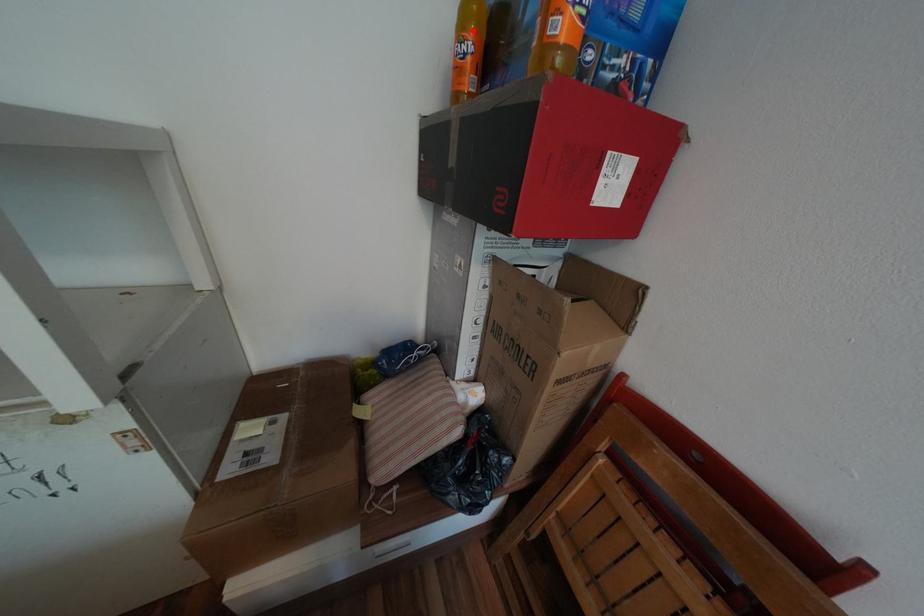
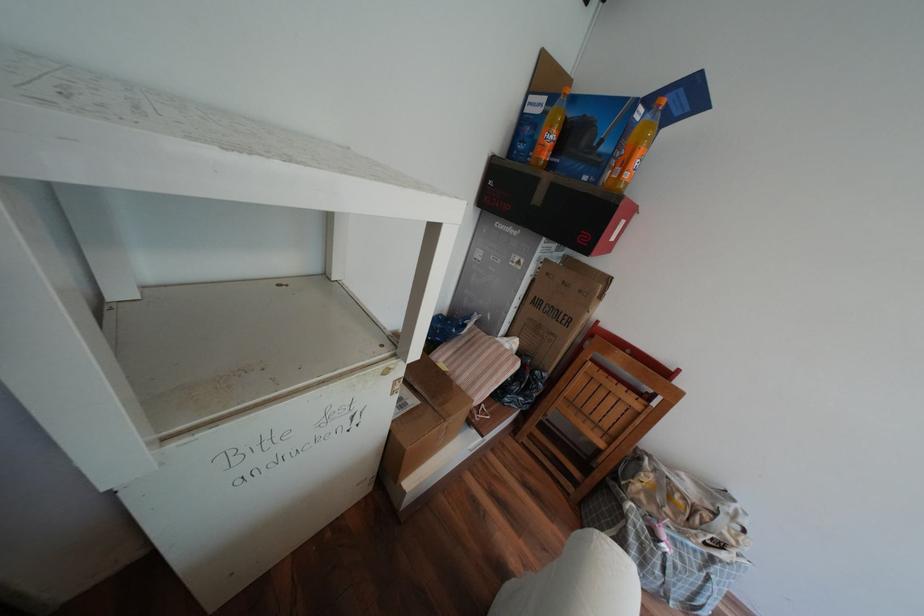
Locate, in the second image, the point that corresponds to the highlighted location in the first image.

(561, 127)